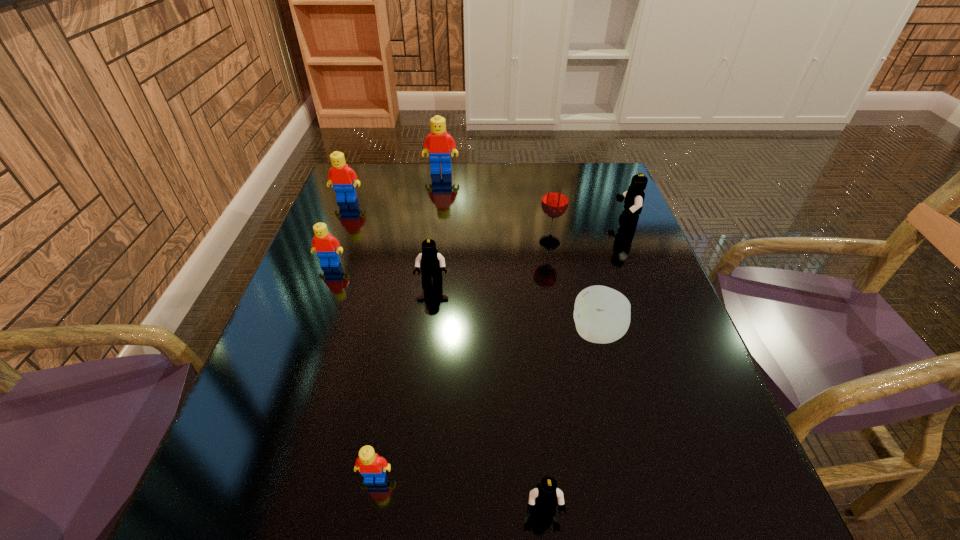
The height and width of the screenshot is (540, 960). Find the location of `unoccupied area between the leftmost black Lego and the fourth farthest object`. unoccupied area between the leftmost black Lego and the fourth farthest object is located at coordinates (491, 263).

Identify the location of unoccupied area between the farthest object and the fifth nearest object. [386, 218].

I want to click on free space that is in between the tallest Lego and the second nearest object, so click(x=408, y=325).

Locate an element on the screen. The width and height of the screenshot is (960, 540). empty location between the nearest object and the fifth nearest object is located at coordinates (437, 388).

You are a GUI agent. You are given a task and a screenshot of the screen. Output one action in this format:
    pyautogui.click(x=<x>, y=<y>)
    Task: Click on the vacant area that lies between the second black Lego from left to right and the eighth farthest object
    This screenshot has width=960, height=540.
    Given the screenshot: What is the action you would take?
    pyautogui.click(x=460, y=495)

Where is `blank region between the second nearest red Lego and the second nearest object`? blank region between the second nearest red Lego and the second nearest object is located at coordinates (353, 371).

I want to click on free space that is in between the second nearest black Lego and the smallest black Lego, so click(x=488, y=397).

Where is `vacant point located between the second biggest black Lego and the farthest red Lego`? This screenshot has width=960, height=540. vacant point located between the second biggest black Lego and the farthest red Lego is located at coordinates (437, 227).

Locate an element on the screen. object that ranks as the eighth closest to the nearest black Lego is located at coordinates (439, 143).

Locate an element on the screen. This screenshot has width=960, height=540. object that is the seventh closest to the second nearest Lego is located at coordinates (634, 197).